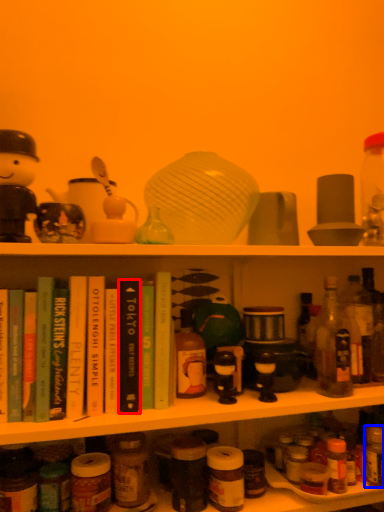
Question: Which of the following is the closest to the observer, book (highlighted by a red box) or bottle (highlighted by a blue box)?

Choices:
 (A) book
 (B) bottle

Answer: (A)